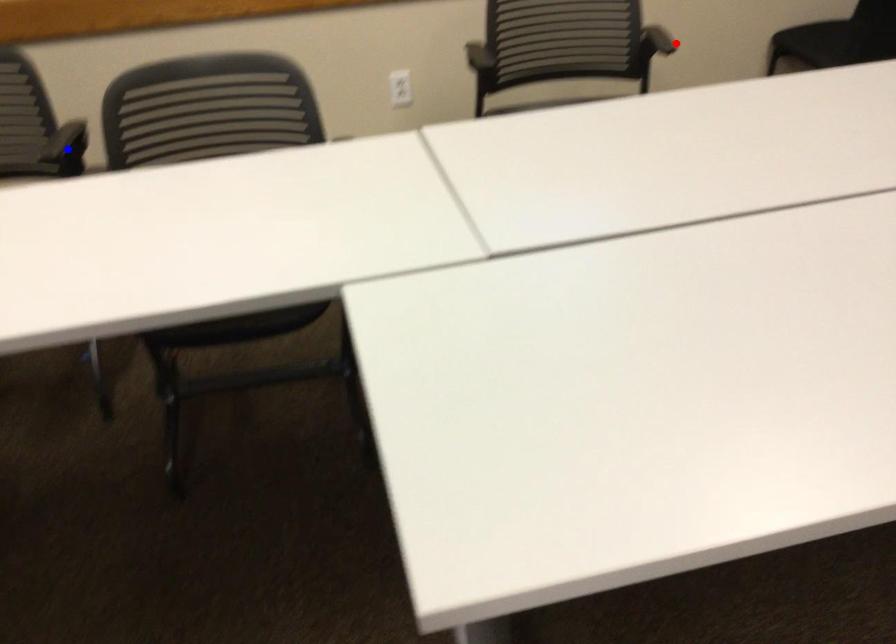
Question: Which of the two points in the image is closer to the camera?

Choices:
 (A) Blue point is closer.
 (B) Red point is closer.

Answer: (A)